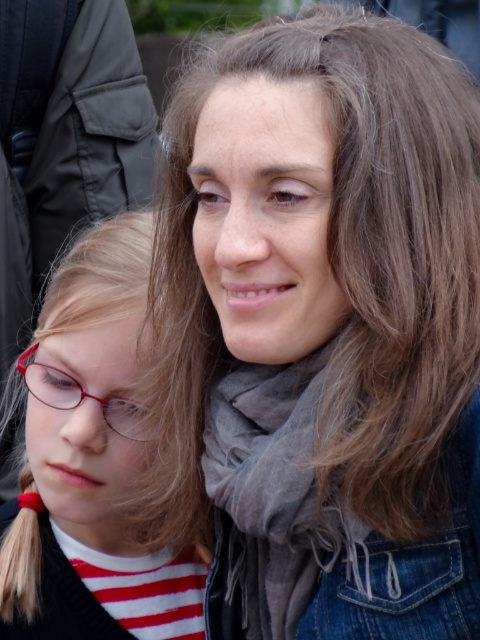
Looking at this image, you are an optometrist examining the image. You need to determine if the matte red glasses at left can be placed on top of the gray soft scarf at center without falling off. What should you consider based on their sizes?

The matte red glasses at left has a greater height compared to gray soft scarf at center, so they might not fit properly and could fall off if placed on top.

You are standing in front of the two people in the image. There are two points marked in the image. The first point is at coordinate point (180, 394) and the second point is at coordinate point (36, 397). Which point is closer to you?

Point (180, 394) is closer to the viewer than point (36, 397).